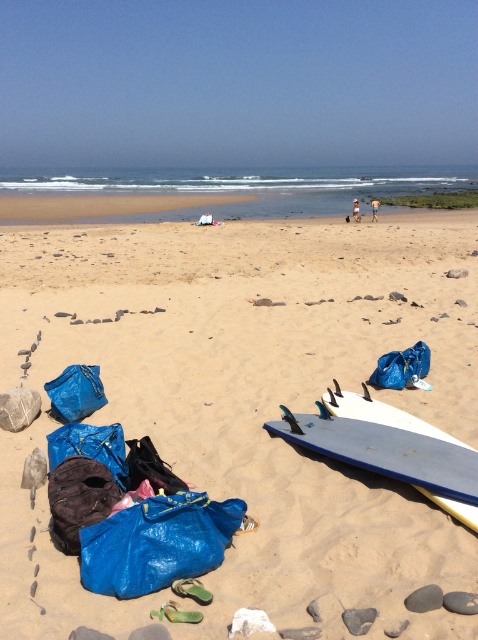
Does smooth sand at center appear under blue fabric bag at lower left?

Incorrect, smooth sand at center is not positioned below blue fabric bag at lower left.

Who is shorter, smooth sand at center or blue fabric bag at lower left?

Standing shorter between the two is blue fabric bag at lower left.

Is point (245, 536) less distant than point (78, 381)?

Yes.

Locate an element on the screen. Image resolution: width=478 pixels, height=640 pixels. smooth sand at center is located at coordinates (246, 404).

Between dark brown fabric bag at lower left and blue fabric bag at lower right, which one has less height?

Standing shorter between the two is blue fabric bag at lower right.

Does dark brown fabric bag at lower left have a larger size compared to blue fabric bag at lower right?

Incorrect, dark brown fabric bag at lower left is not larger than blue fabric bag at lower right.

What do you see at coordinates (78, 499) in the screenshot? I see `dark brown fabric bag at lower left` at bounding box center [78, 499].

Locate an element on the screen. dark brown fabric bag at lower left is located at coordinates (78, 499).

Between point (55, 509) and point (66, 406), which one is positioned in front?

Point (55, 509) is more forward.

Locate an element on the screen. dark brown fabric bag at lower left is located at coordinates (78, 499).

Which is behind, point (104, 465) or point (76, 404)?

The point (76, 404) is more distant.

The width and height of the screenshot is (478, 640). I want to click on dark brown fabric bag at lower left, so [78, 499].